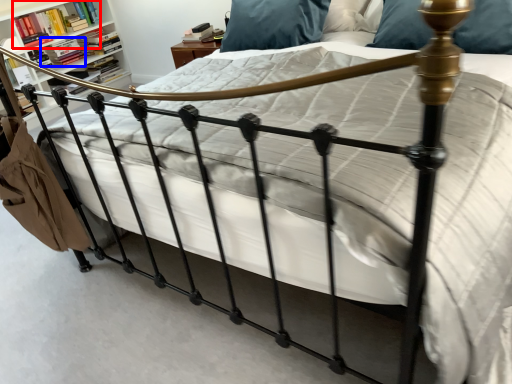
Question: Which object is closer to the camera taking this photo, book (highlighted by a red box) or book (highlighted by a blue box)?

Choices:
 (A) book
 (B) book

Answer: (A)